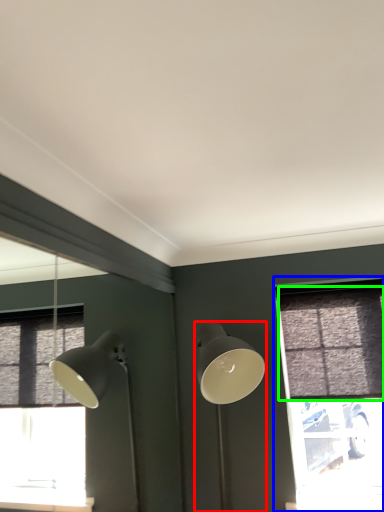
Question: Estimate the real-world distances between objects in this image. Which object is closer to lamp (highlighted by a red box), window (highlighted by a blue box) or curtain (highlighted by a green box)?

Choices:
 (A) window
 (B) curtain

Answer: (B)